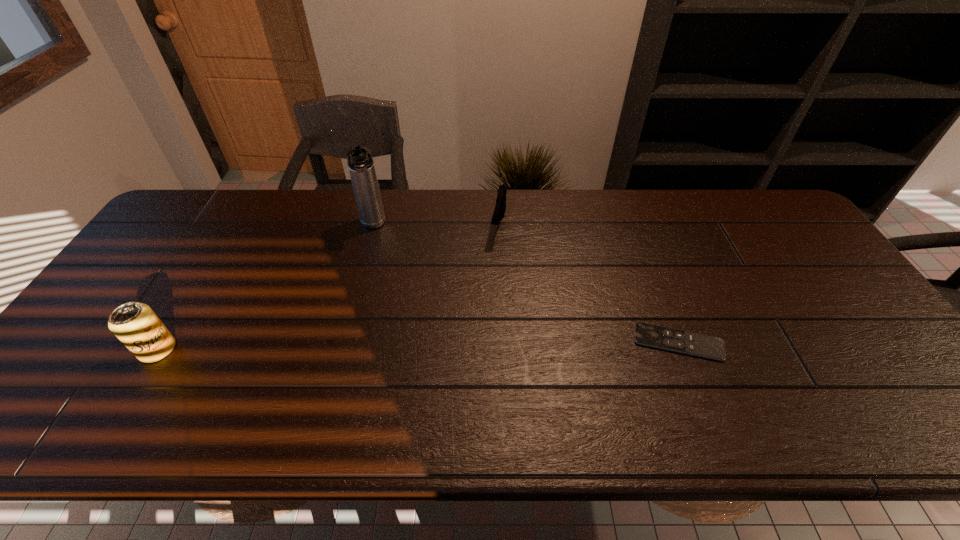
This screenshot has height=540, width=960. What are the coordinates of `free space on the desktop that is between the leftmost object and the rightmost object and is positioned on the front-facing side of the second object from right to left` in the screenshot? It's located at (470, 345).

Image resolution: width=960 pixels, height=540 pixels. Find the location of `free space on the desktop that is between the second tallest object and the remote control and is positioned on the handle side of the thermos bottle`. free space on the desktop that is between the second tallest object and the remote control and is positioned on the handle side of the thermos bottle is located at coordinates (390, 346).